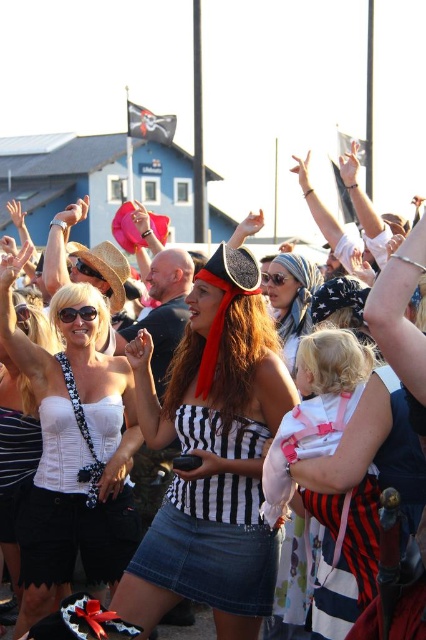
Question: Is the position of striped fabric skirt at center more distant than that of matte black goggles at center?

Choices:
 (A) no
 (B) yes

Answer: (A)

Question: Is striped fabric top at center bigger than striped fabric skirt at center?

Choices:
 (A) no
 (B) yes

Answer: (B)

Question: Among these objects, which one is nearest to the camera?

Choices:
 (A) striped fabric skirt at center
 (B) white scarf at center

Answer: (A)

Question: Which point appears farthest from the camera in this image?

Choices:
 (A) (75, 268)
 (B) (290, 262)
 (C) (69, 310)

Answer: (A)

Question: Observing the image, what is the correct spatial positioning of white scarf at center in reference to black matte goggles at center?

Choices:
 (A) below
 (B) above

Answer: (B)

Question: Estimate the real-world distances between objects in this image. Which object is farther from the white scarf at center?

Choices:
 (A) black matte goggles at center
 (B) black plastic goggles at center
 (C) white matte corset at center
 (D) matte black goggles at center

Answer: (C)